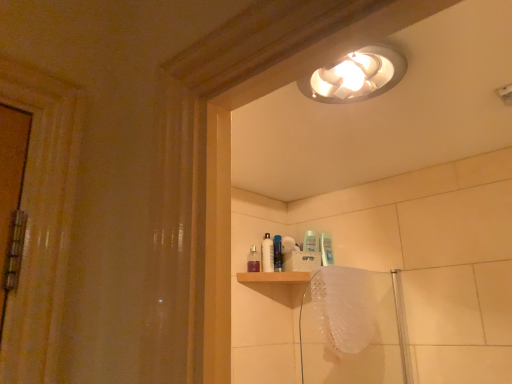
Question: Is translucent plastic shower door at lower right to the left of translucent plastic bath towel at lower right from the viewer's perspective?

Choices:
 (A) no
 (B) yes

Answer: (A)

Question: Would you say translucent plastic shower door at lower right is outside translucent plastic bath towel at lower right?

Choices:
 (A) no
 (B) yes

Answer: (B)

Question: Considering the relative positions of translucent plastic shower door at lower right and translucent plastic bath towel at lower right in the image provided, is translucent plastic shower door at lower right to the right of translucent plastic bath towel at lower right from the viewer's perspective?

Choices:
 (A) yes
 (B) no

Answer: (A)

Question: Does translucent plastic shower door at lower right turn towards translucent plastic bath towel at lower right?

Choices:
 (A) no
 (B) yes

Answer: (B)

Question: Is translucent plastic shower door at lower right facing away from translucent plastic bath towel at lower right?

Choices:
 (A) no
 (B) yes

Answer: (B)

Question: In the image, is translucent plastic spray bottle at upper center, which is the first toiletry in left-to-right order, positioned in front of or behind white plastic bottle at center, which is the 2th toiletry from right to left?

Choices:
 (A) front
 (B) behind

Answer: (A)

Question: Do you think translucent plastic spray bottle at upper center, the third toiletry from the right, is within white plastic bottle at center, the second toiletry when ordered from left to right, or outside of it?

Choices:
 (A) inside
 (B) outside

Answer: (B)

Question: Does point (254, 269) appear closer or farther from the camera than point (272, 248)?

Choices:
 (A) farther
 (B) closer

Answer: (B)

Question: From a real-world perspective, is translucent plastic spray bottle at upper center, which is the first toiletry in left-to-right order, positioned above or below white plastic bottle at center, the second toiletry when ordered from left to right?

Choices:
 (A) above
 (B) below

Answer: (B)

Question: Is blue glossy bottle at center, positioned as the 1th toiletry in right-to-left order, bigger or smaller than translucent plastic bath towel at lower right?

Choices:
 (A) small
 (B) big

Answer: (A)

Question: In the image, is blue glossy bottle at center, positioned as the 1th toiletry in right-to-left order, on the left side or the right side of translucent plastic bath towel at lower right?

Choices:
 (A) left
 (B) right

Answer: (A)

Question: From a real-world perspective, is blue glossy bottle at center, which ranks as the third toiletry in left-to-right order, positioned above or below translucent plastic bath towel at lower right?

Choices:
 (A) below
 (B) above

Answer: (B)

Question: Relative to translucent plastic bath towel at lower right, is blue glossy bottle at center, which ranks as the third toiletry in left-to-right order, in front or behind?

Choices:
 (A) behind
 (B) front

Answer: (A)

Question: In terms of width, does translucent plastic spray bottle at upper center, the third toiletry from the right, look wider or thinner when compared to translucent plastic shower door at lower right?

Choices:
 (A) thin
 (B) wide

Answer: (A)

Question: In the image, is translucent plastic spray bottle at upper center, the third toiletry from the right, on the left side or the right side of translucent plastic shower door at lower right?

Choices:
 (A) left
 (B) right

Answer: (A)